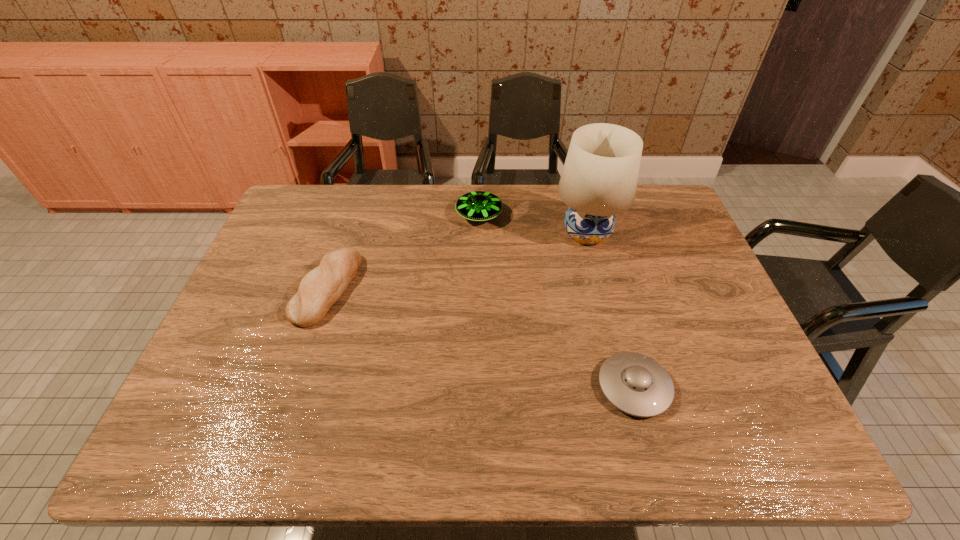
At what (x,y) coordinates should I click in order to perform the action: click on the tallest object. Please return your answer as a coordinate pair (x, y). Looking at the image, I should click on (599, 179).

You are a GUI agent. You are given a task and a screenshot of the screen. Output one action in this format:
    pyautogui.click(x=<x>, y=<y>)
    Task: Click on the taller saucer
    The image size is (960, 540).
    Given the screenshot: What is the action you would take?
    pyautogui.click(x=478, y=206)

I want to click on the farther saucer, so click(x=478, y=206).

This screenshot has height=540, width=960. I want to click on bread, so click(320, 289).

This screenshot has width=960, height=540. I want to click on the leftmost object, so click(320, 289).

Locate an element on the screen. the shorter saucer is located at coordinates (636, 384).

Identify the location of the nearest object. (636, 384).

Identify the location of free location located 0.260m on the front-facing side of the lampshade. The image size is (960, 540). (611, 327).

Where is `free spot located 0.350m on the right of the taller saucer`? The width and height of the screenshot is (960, 540). free spot located 0.350m on the right of the taller saucer is located at coordinates (608, 215).

The width and height of the screenshot is (960, 540). I want to click on blank area located 0.120m on the back of the leftmost object, so click(x=347, y=229).